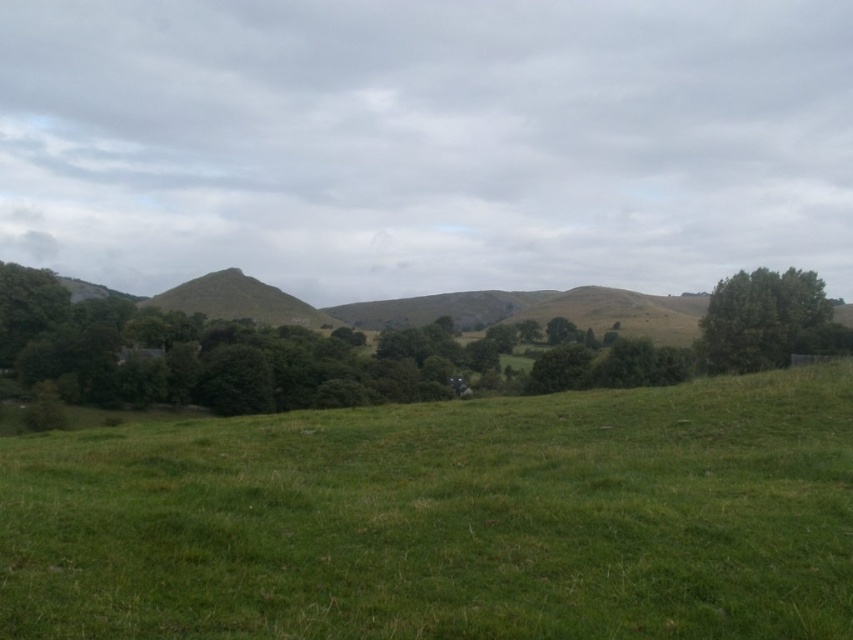
You are standing in the middle of the green grassy field at center and want to walk to the green leafy tree at right. Which direction should you head towards?

The green grassy field at center is positioned on the left side of the green leafy tree at right, so you should head towards the right to reach the green leafy tree at right.

Consider the image. You are standing in the rural landscape and want to walk from the point at coordinates point (454, 440) to the point at coordinates point (756, 355). Since you can see both points, which direction should you face to walk towards the second point?

Point (454, 440) is in front of point (756, 355), so to walk towards point (756, 355), you should face away from the direction of point (454, 440).

You are a hiker who wants to take a photo of the green leafy tree at right and the green grassy field at center. Which object should you focus on first if you want to capture both in the same frame?

The green grassy field at center is smaller than the green leafy tree at right, so you should focus on the green leafy tree at right first to ensure it fits in the frame while still capturing the smaller green grassy field at center.